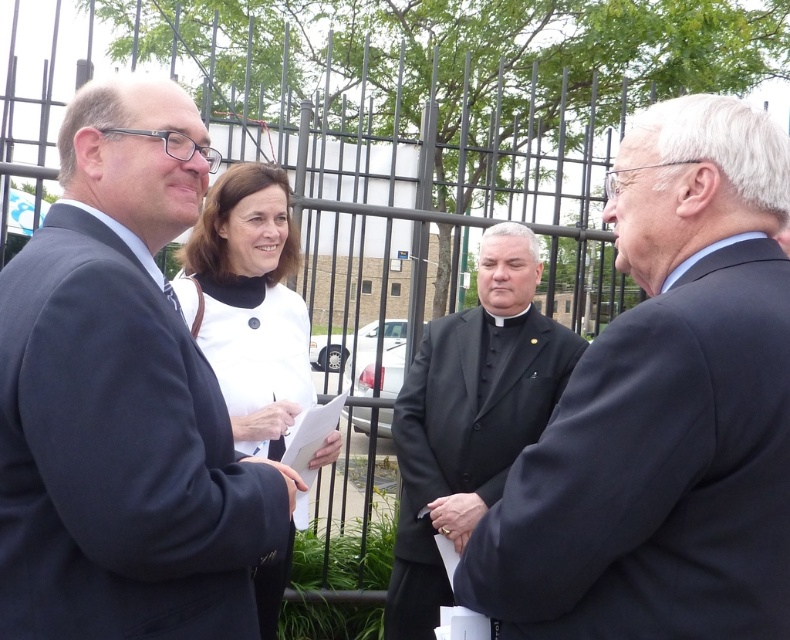
Is black matte suit at right smaller than black matte suit at center?

Correct, black matte suit at right occupies less space than black matte suit at center.

Which is behind, point (757, 444) or point (453, 467)?

The point (453, 467) is behind.

Is point (591, 566) positioned behind point (480, 336)?

No, (591, 566) is closer to viewer.

Where is `black matte suit at right`? black matte suit at right is located at coordinates (664, 410).

Does matte black suit at left have a greater width compared to white matte jacket at center?

No, matte black suit at left is not wider than white matte jacket at center.

Between point (141, 628) and point (313, 458), which one is positioned in front?

Positioned in front is point (141, 628).

What do you see at coordinates (122, 401) in the screenshot?
I see `matte black suit at left` at bounding box center [122, 401].

Where is `matte black suit at left`? The width and height of the screenshot is (790, 640). matte black suit at left is located at coordinates (122, 401).

In the scene shown: Does black matte suit at right have a smaller size compared to white matte jacket at center?

Indeed, black matte suit at right has a smaller size compared to white matte jacket at center.

This screenshot has height=640, width=790. Describe the element at coordinates (664, 410) in the screenshot. I see `black matte suit at right` at that location.

Where is `black matte suit at right`? black matte suit at right is located at coordinates (664, 410).